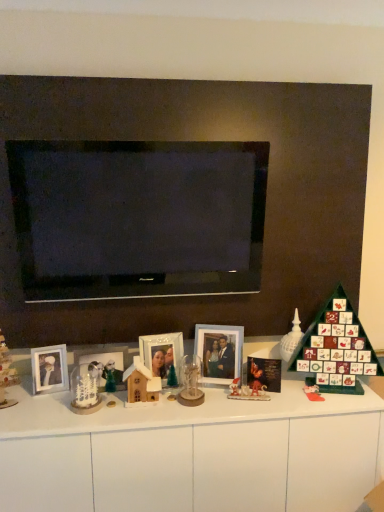
You are a GUI agent. You are given a task and a screenshot of the screen. Output one action in this format:
    pyautogui.click(x=<x>, y=<y>)
    Task: Click on the free location in front of white frosted glass candle holder at lower left, positioned as the first candle holder in left-to-right order
    The height and width of the screenshot is (512, 384).
    Given the screenshot: What is the action you would take?
    pyautogui.click(x=74, y=421)